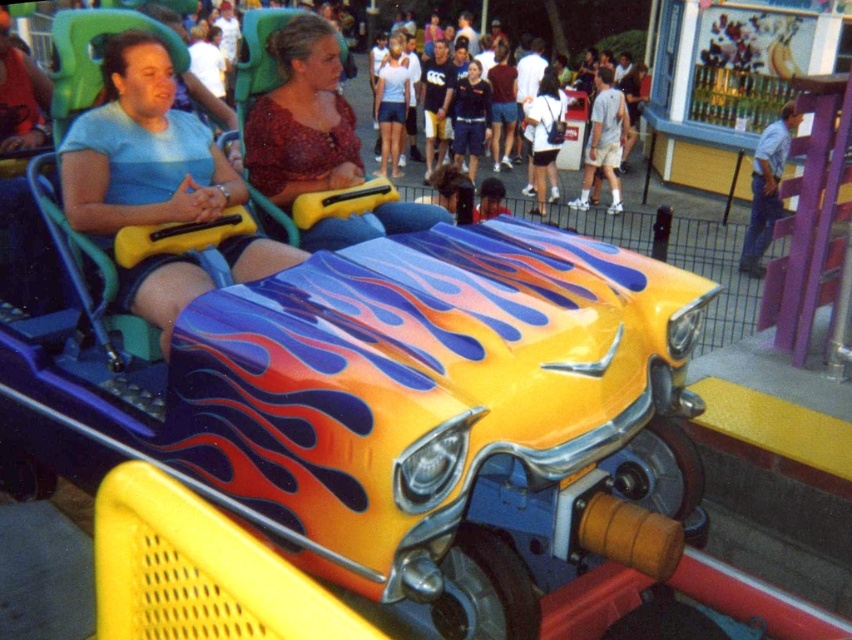
Based on the photo, you are a photographer at the theme park and want to capture both the matte blue shorts at left and the matte red blouse at center in a single photo. Since you want both to be clearly visible, which object should you focus on to ensure the larger one is in sharp focus?

The matte blue shorts at left is larger than the matte red blouse at center, so you should focus on the matte blue shorts at left to ensure it is in sharp focus.

You are a photographer at the theme park and want to capture a photo of the two guests wearing the matte blue shorts at left and the matte red blouse at center. Which clothing item should you focus on first if you want to ensure both are in the frame without moving the camera?

The matte blue shorts at left is taller than the matte red blouse at center, so you should focus on the matte blue shorts at left first to ensure both are in frame without moving the camera.